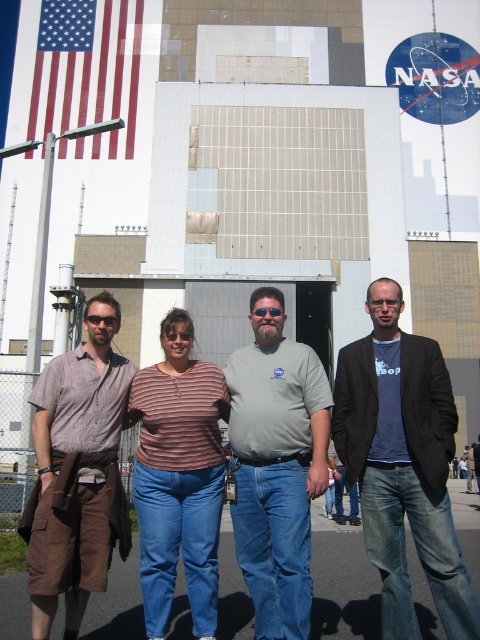
You are standing at the center of the image and want to locate the brown cotton cargo shorts at left. In which direction should you look to find them?

The brown cotton cargo shorts at left are located at point (76, 477), so you should look to the left side of the image to find them.